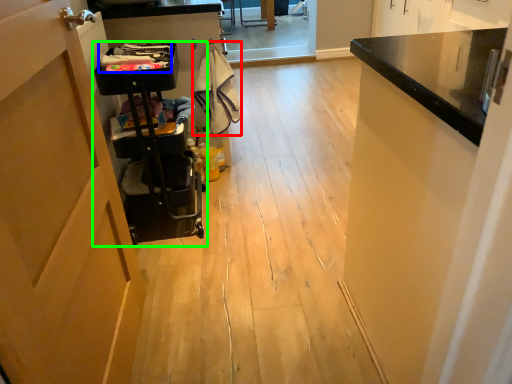
Question: Which object is the closest to the laundry (highlighted by a red box)? Choose among these: laundry (highlighted by a blue box) or trolley (highlighted by a green box).

Choices:
 (A) laundry
 (B) trolley

Answer: (A)